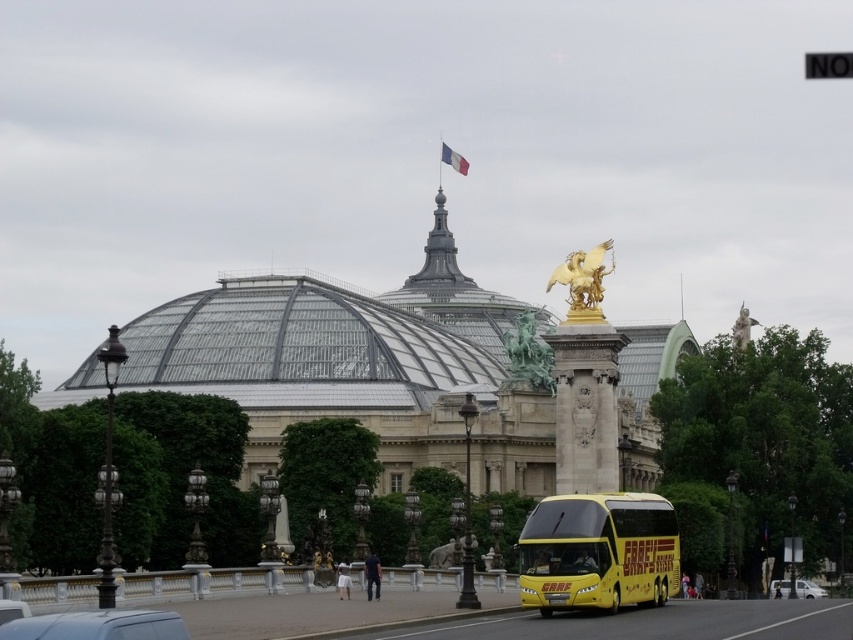
Question: Does green patina statue at center appear under white matte van at lower right?

Choices:
 (A) no
 (B) yes

Answer: (A)

Question: Which of the following is the closest to the observer?

Choices:
 (A) (753, 323)
 (B) (260, 401)

Answer: (B)

Question: Considering the real-world distances, which object is closest to the metallic gray van at lower left?

Choices:
 (A) matte glass dome at center
 (B) green patina statue at center
 (C) white matte van at lower right

Answer: (C)

Question: Among these objects, which one is nearest to the camera?

Choices:
 (A) gold metallic winged horse at center
 (B) yellow matte/decorative bus at lower right
 (C) white matte van at lower right

Answer: (B)

Question: Observing the image, what is the correct spatial positioning of matte glass dome at center in reference to green patina statue at center?

Choices:
 (A) left
 (B) right

Answer: (A)

Question: Is yellow matte/decorative bus at lower right positioned before green patina statue at center?

Choices:
 (A) yes
 (B) no

Answer: (A)